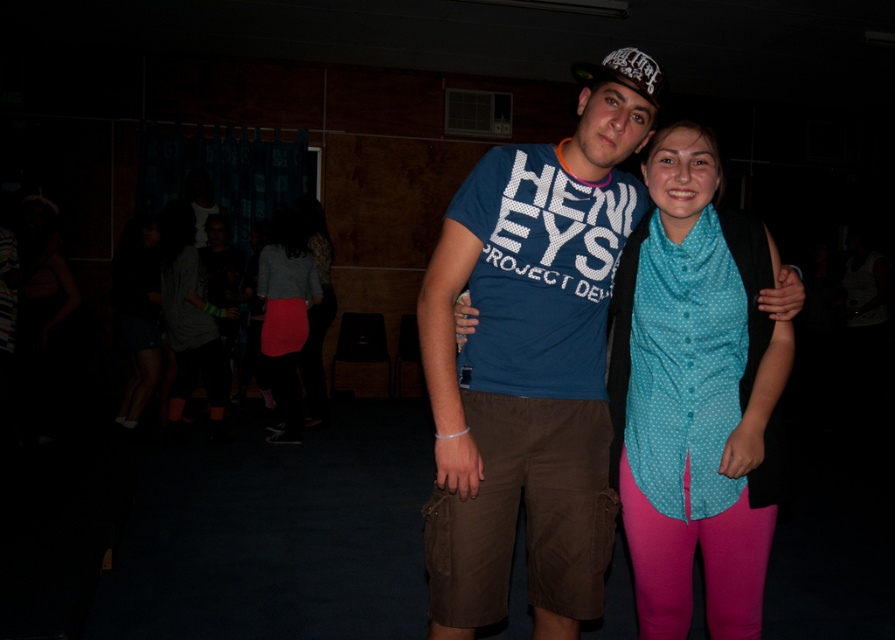
Can you confirm if blue t-shirt at center is positioned to the left of matte pink skirt at center?

In fact, blue t-shirt at center is to the right of matte pink skirt at center.

Does blue t-shirt at center have a lesser height compared to matte pink skirt at center?

Yes.

Who is more forward, (x=610, y=168) or (x=271, y=330)?

Positioned in front is point (x=610, y=168).

At what (x,y) coordinates should I click in order to perform the action: click on blue t-shirt at center. Please return your answer as a coordinate pair (x, y). Looking at the image, I should click on (530, 362).

Does teal polka dot blouse at center have a lesser width compared to matte pink skirt at lower left?

Yes, teal polka dot blouse at center is thinner than matte pink skirt at lower left.

Between teal polka dot blouse at center and matte pink skirt at lower left, which one has more height?

matte pink skirt at lower left is taller.

Between point (735, 212) and point (209, 292), which one is positioned in front?

Point (735, 212) is in front.

I want to click on teal polka dot blouse at center, so click(x=697, y=394).

Which of these two, blue t-shirt at center or teal polka dot blouse at center, stands taller?

blue t-shirt at center

Can you confirm if blue t-shirt at center is shorter than teal polka dot blouse at center?

Incorrect, blue t-shirt at center's height does not fall short of teal polka dot blouse at center's.

Is point (603, 113) more distant than point (744, 488)?

That is False.

Locate an element on the screen. The width and height of the screenshot is (895, 640). blue t-shirt at center is located at coordinates (530, 362).